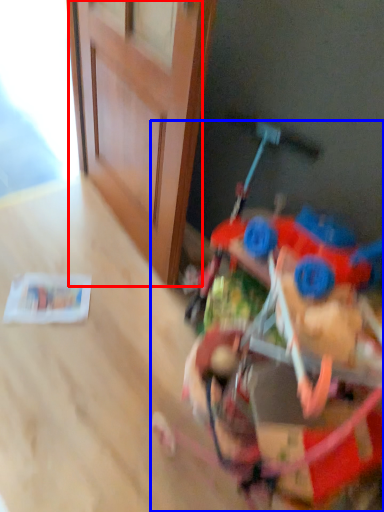
Question: Which point is closer to the camera, door (highlighted by a red box) or toy (highlighted by a blue box)?

Choices:
 (A) door
 (B) toy

Answer: (B)